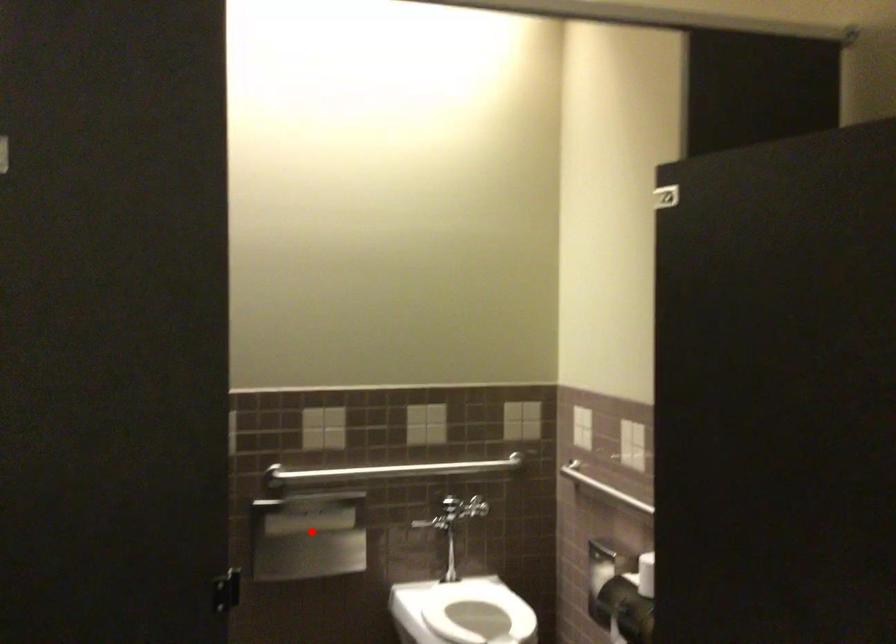
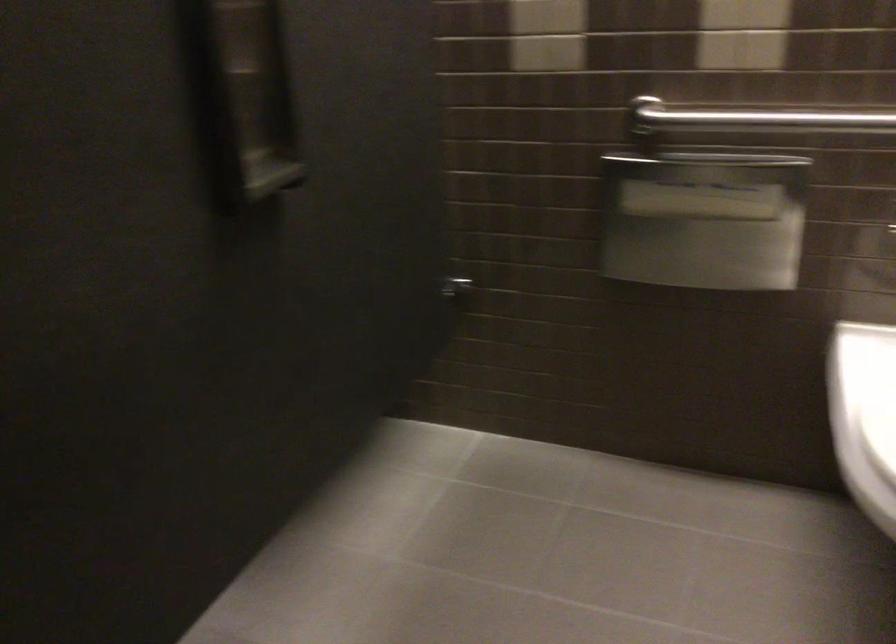
Question: I am providing you with two images of the same scene from different viewpoints. Image1 has a red point marked. In image2, the corresponding 3D location appears at what relative position? Reply with the corresponding letter.

Choices:
 (A) Closer
 (B) Farther

Answer: (A)